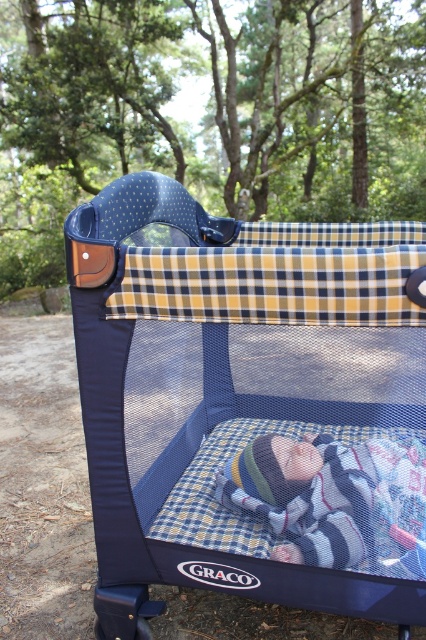
You are a parent trying to ensure your baby stays safe in the playpen. Considering the size difference between the navy blue mesh playpen at center and the striped knit hat at center, which item is more likely to provide adequate space for the baby to move around comfortably?

The navy blue mesh playpen at center has a larger size compared to the striped knit hat at center, so it is more likely to provide adequate space for the baby to move around comfortably.

You are a parent trying to locate your baby hat. You see the navy blue mesh playpen at center and the striped knit hat at center. Which object is positioned more to the left?

The striped knit hat at center is positioned more to the left than the navy blue mesh playpen at center.

You are a photographer setting up a shot of the Graco portable playpen in the woods. You have two points marked on your viewfinder at coordinates point (319, 234) and point (393, 486). Which point is closer to the camera?

Point (319, 234) is further to the camera than point (393, 486), so point (393, 486) is closer to the camera.